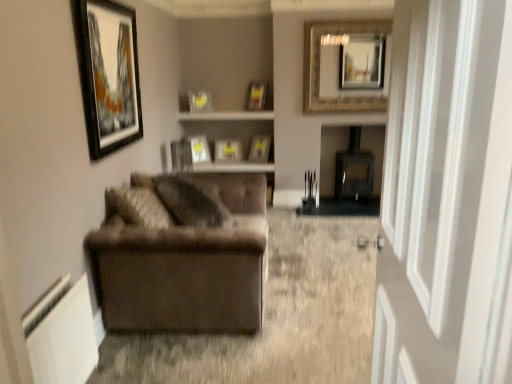
Question: Would you say matte black picture frame at center, the 7th picture frame viewed from the front, is part of black glossy picture frame at upper left, placed as the 8th picture frame when sorted from back to front,'s contents?

Choices:
 (A) no
 (B) yes

Answer: (A)

Question: From the image's perspective, is black glossy picture frame at upper left, placed as the 8th picture frame when sorted from back to front, on top of matte black picture frame at center, which is counted as the 3th picture frame, starting from the left?

Choices:
 (A) no
 (B) yes

Answer: (B)

Question: Is black glossy picture frame at upper left, positioned as the first picture frame in left-to-right order, bigger than matte black picture frame at center, placed as the sixth picture frame when sorted from right to left?

Choices:
 (A) no
 (B) yes

Answer: (B)

Question: Is black glossy picture frame at upper left, positioned as the first picture frame in left-to-right order, outside of matte black picture frame at center, placed as the sixth picture frame when sorted from right to left?

Choices:
 (A) yes
 (B) no

Answer: (A)

Question: Is black glossy picture frame at upper left, placed as the 8th picture frame when sorted from back to front, facing away from matte black picture frame at center, placed as the sixth picture frame when sorted from right to left?

Choices:
 (A) no
 (B) yes

Answer: (A)

Question: Considering the positions of velvet brown couch at left and matte glass picture frame at upper center, the 5th picture frame positioned from the right, in the image, is velvet brown couch at left bigger or smaller than matte glass picture frame at upper center, the 5th picture frame positioned from the right,?

Choices:
 (A) big
 (B) small

Answer: (A)

Question: From the image's perspective, is velvet brown couch at left positioned above or below matte glass picture frame at upper center, which appears as the fourth picture frame when viewed from the back?

Choices:
 (A) above
 (B) below

Answer: (B)

Question: In the image, is velvet brown couch at left on the left side or the right side of matte glass picture frame at upper center, the 5th picture frame positioned from the front?

Choices:
 (A) right
 (B) left

Answer: (A)

Question: Is point (233, 228) positioned closer to the camera than point (187, 94)?

Choices:
 (A) farther
 (B) closer

Answer: (B)

Question: Considering the relative positions of transparent glass door at right and brown fabric armchair at left in the image provided, is transparent glass door at right to the left or to the right of brown fabric armchair at left?

Choices:
 (A) left
 (B) right

Answer: (B)

Question: Does point (488, 304) appear closer or farther from the camera than point (306, 382)?

Choices:
 (A) closer
 (B) farther

Answer: (A)

Question: From the image's perspective, is transparent glass door at right above or below brown fabric armchair at left?

Choices:
 (A) above
 (B) below

Answer: (A)

Question: Is transparent glass door at right taller or shorter than brown fabric armchair at left?

Choices:
 (A) tall
 (B) short

Answer: (A)

Question: Does point 204,99 appear closer or farther from the camera than point 216,327?

Choices:
 (A) closer
 (B) farther

Answer: (B)

Question: Which is correct: matte glass picture frame at upper center, which appears as the fourth picture frame when viewed from the back, is inside velvet brown couch at left, or outside of it?

Choices:
 (A) outside
 (B) inside

Answer: (A)